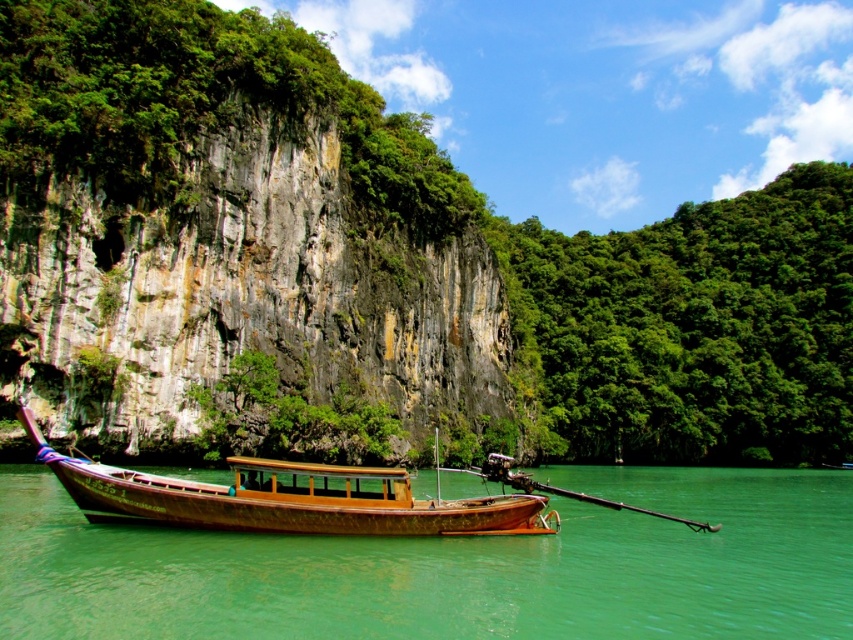
In the scene shown: You are a passenger on the wooden boat at center. You want to jump into the water. Is the green water at boat center directly below you?

The green water at boat center is directly below the wooden boat at center, so yes, you can jump into the green water at boat center from the wooden boat at center.

You are a tourist on a longtail boat anchored in a tropical location. You want to take a photo of the green water at boat center. Where exactly should you point your camera?

You should point your camera at point coordinates of (451,566) to capture the green water at boat center.